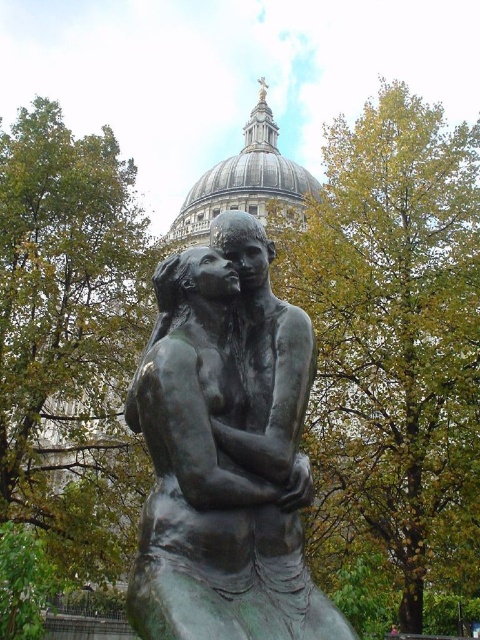
You are standing at the point with coordinates point (26,472) and want to take a photo of the bronze statue of two figures embracing each other. Is the point (251,406) blocking your view of the statue?

Point (251,406) is in front of point (26,472), so yes, it will block your view of the bronze statue of two figures embracing each other.

You are a tourist standing at the base of the bronze statue of two figures embracing each other. You want to take a photo of the iconic dome of St. Paul Cathedral without any obstructions. Is the green leafy tree at center blocking your view of the dome?

The green leafy tree at center is positioned at point (391, 330), which is likely blocking the view of the dome of St. Paul Cathedral. To take an unobstructed photo, you may need to move to a different angle or position to avoid the tree.

You are an art student visiting St. Paul Cathedral and want to sketch the bronze statue at center. You notice a green leafy tree at center in the background. Which object is larger in size?

The green leafy tree at center is bigger than bronze statue at center, so the tree is larger in size.